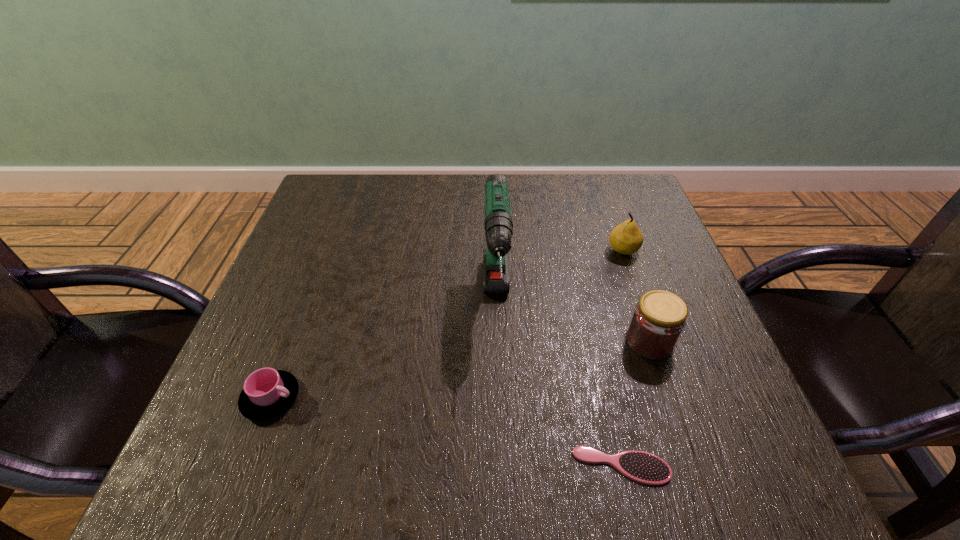
Where is `the second object from left to right`? The width and height of the screenshot is (960, 540). the second object from left to right is located at coordinates (498, 224).

Where is `drill`? Image resolution: width=960 pixels, height=540 pixels. drill is located at coordinates (498, 224).

What are the coordinates of `pear` in the screenshot? It's located at (626, 238).

Locate an element on the screen. The image size is (960, 540). jam is located at coordinates (659, 318).

Where is `cup`? The width and height of the screenshot is (960, 540). cup is located at coordinates (267, 393).

In order to click on the fourth tallest object in this screenshot , I will do pyautogui.click(x=267, y=393).

Locate an element on the screen. This screenshot has height=540, width=960. hairbrush is located at coordinates (643, 467).

Where is `the shortest object`? The height and width of the screenshot is (540, 960). the shortest object is located at coordinates (x=643, y=467).

Locate an element on the screen. The height and width of the screenshot is (540, 960). free point located 0.080m on the handle side of the fourth object from right to left is located at coordinates tap(499, 395).

Find the location of a particular element. Image resolution: width=960 pixels, height=540 pixels. vacant space located on the front of the pear is located at coordinates (681, 413).